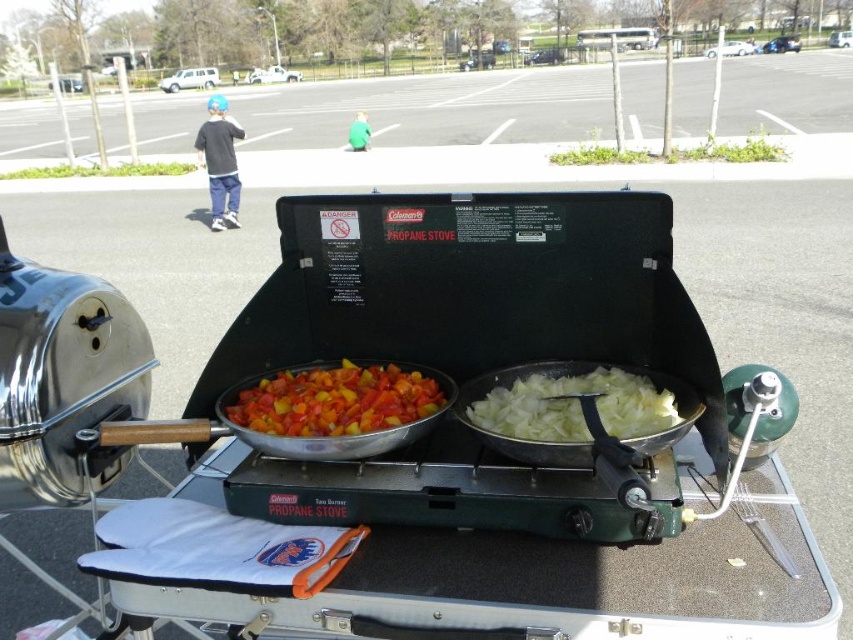
Who is taller, vividly colored vegetables at center or white translucent onions at right?

Standing taller between the two is vividly colored vegetables at center.

Between point (318, 380) and point (468, 412), which one is positioned in front?

Point (468, 412)

Which is behind, point (291, 380) or point (595, 369)?

Positioned behind is point (291, 380).

This screenshot has height=640, width=853. In order to click on vividly colored vegetables at center in this screenshot , I will do `click(335, 401)`.